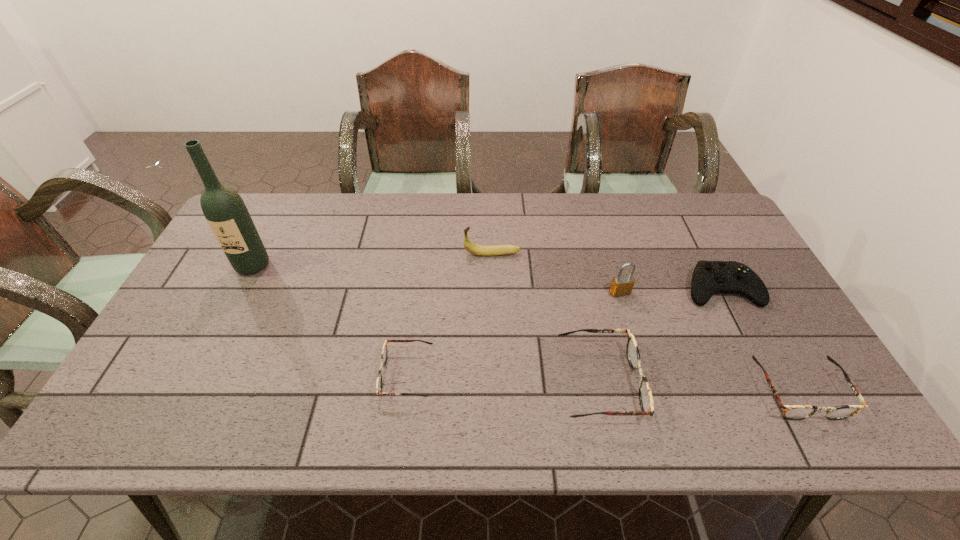
At what (x,y) coordinates should I click in order to perform the action: click on vacant place for an extra spectacles on the left. Please return your answer as a coordinate pair (x, y). The height and width of the screenshot is (540, 960). Looking at the image, I should click on (220, 367).